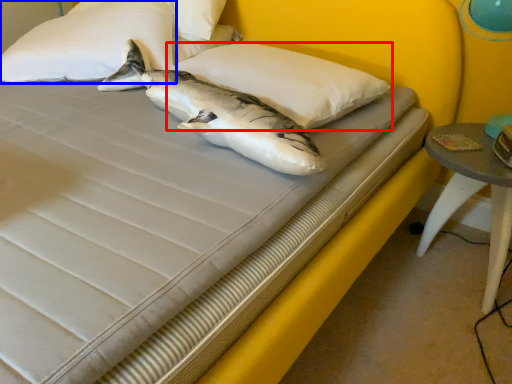
Question: Among these objects, which one is nearest to the camera, pillow (highlighted by a red box) or pillow (highlighted by a blue box)?

Choices:
 (A) pillow
 (B) pillow

Answer: (A)